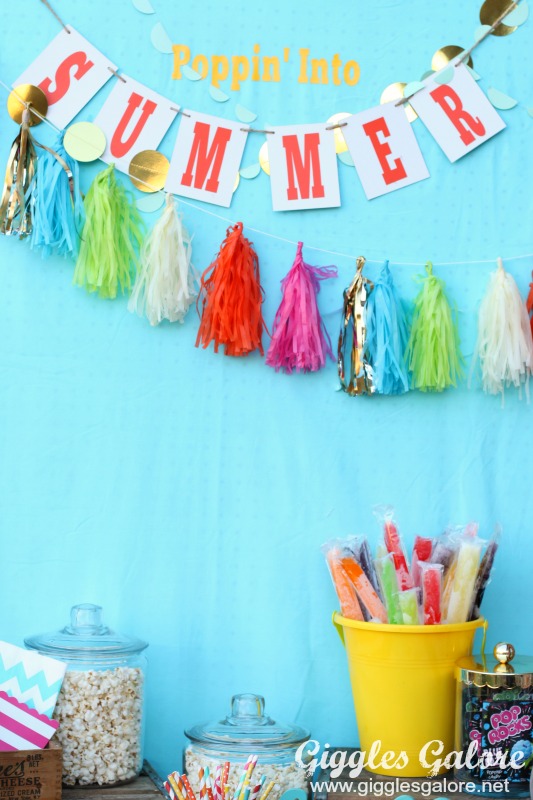
Where is `napkins`? napkins is located at coordinates (23, 732), (31, 676).